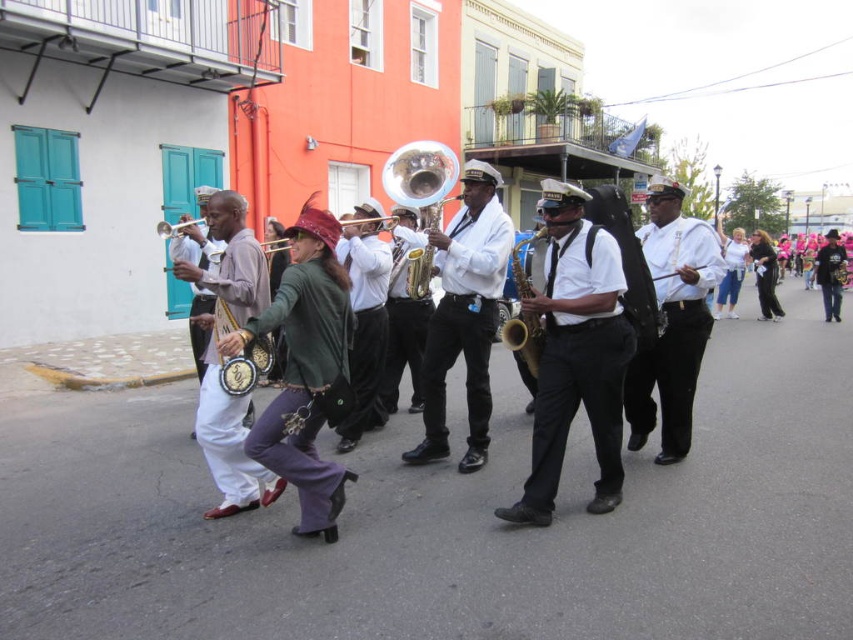
You are a photographer trying to capture the band members in the middle of the parade. Since you want to focus on the instruments, you need to know which object is bigger to adjust your camera settings. Which one is larger between the white matte uniform at center and the brass shiny trumpet at center?

The white matte uniform at center is larger in size than the brass shiny trumpet at center, so you should adjust your camera settings to focus on the larger white matte uniform at center.

You are a photographer trying to capture a photo of the wooden saxophone at center and the gold textured saxophone at center during the parade. Which saxophone should you focus on if you want to include the entire instrument in your shot without cropping?

The wooden saxophone at center is much taller than the gold textured saxophone at center, so you should focus on the wooden saxophone at center to ensure the entire instrument fits in the photo.

You are a photographer trying to capture a photo of the white matte uniform at center and the brass shiny trumpet at center. Which object should you focus on first if you want to ensure both are in focus without adjusting the camera settings?

The white matte uniform at center is positioned under the brass shiny trumpet at center, so focusing on the brass shiny trumpet at center first would help ensure both are in focus since it is closer to the camera.